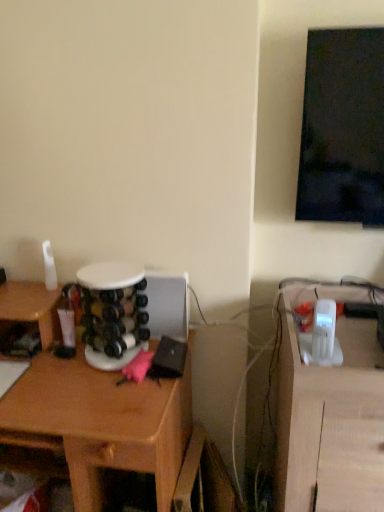
Question: Should I look upward or downward to see wooden desk at left?

Choices:
 (A) down
 (B) up

Answer: (A)

Question: Is wooden desk at left completely or partially outside of white plastic phone at right?

Choices:
 (A) yes
 (B) no

Answer: (A)

Question: Is wooden desk at left with white plastic phone at right?

Choices:
 (A) no
 (B) yes

Answer: (A)

Question: Is wooden desk at left oriented away from white plastic phone at right?

Choices:
 (A) no
 (B) yes

Answer: (A)

Question: From the image's perspective, would you say wooden desk at left is shown under white plastic phone at right?

Choices:
 (A) yes
 (B) no

Answer: (B)

Question: Is wooden desk at left behind white plastic phone at right?

Choices:
 (A) no
 (B) yes

Answer: (B)

Question: Is wooden desk at left bigger than white plastic phone at right?

Choices:
 (A) yes
 (B) no

Answer: (A)

Question: Is white plastic phone at right not inside wooden desk at left?

Choices:
 (A) no
 (B) yes

Answer: (B)

Question: Is white plastic phone at right to the right of wooden desk at left from the viewer's perspective?

Choices:
 (A) no
 (B) yes

Answer: (B)

Question: Is the position of white plastic phone at right more distant than that of wooden desk at left?

Choices:
 (A) yes
 (B) no

Answer: (B)

Question: Considering the relative sizes of white plastic phone at right and wooden desk at left in the image provided, is white plastic phone at right taller than wooden desk at left?

Choices:
 (A) no
 (B) yes

Answer: (B)

Question: Is white plastic phone at right at the left side of wooden desk at left?

Choices:
 (A) no
 (B) yes

Answer: (A)

Question: Does white plastic phone at right turn towards wooden desk at left?

Choices:
 (A) yes
 (B) no

Answer: (B)

Question: From the image's perspective, relative to white plastic phone at right, is wooden desk at left above or below?

Choices:
 (A) above
 (B) below

Answer: (A)